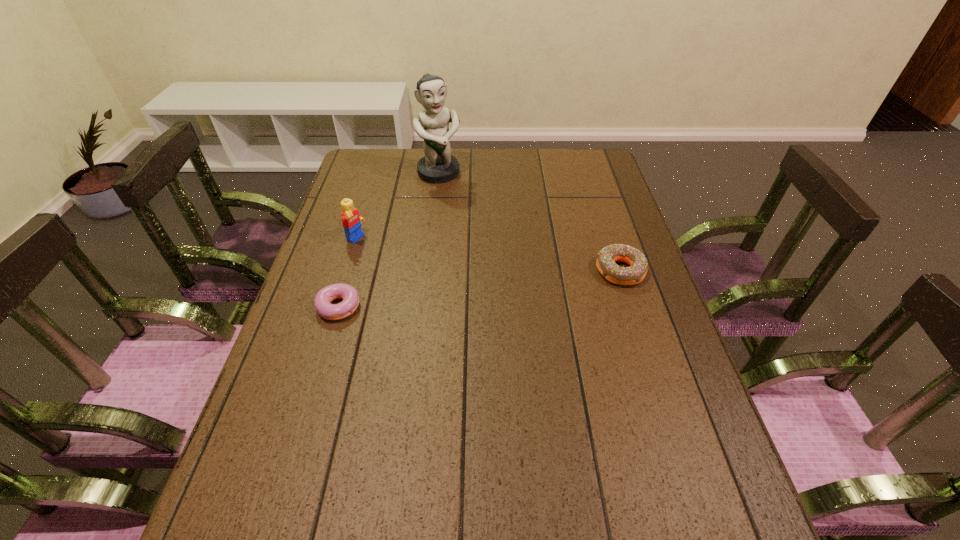
Locate an element on the screen. This screenshot has height=540, width=960. vacant space on the desktop that is between the shortest object and the right doughnut and is positioned on the face of the second tallest object is located at coordinates (461, 291).

I want to click on free spot on the desktop that is between the shorter doughnut and the taller doughnut and is positioned on the front-facing side of the figurine, so click(503, 285).